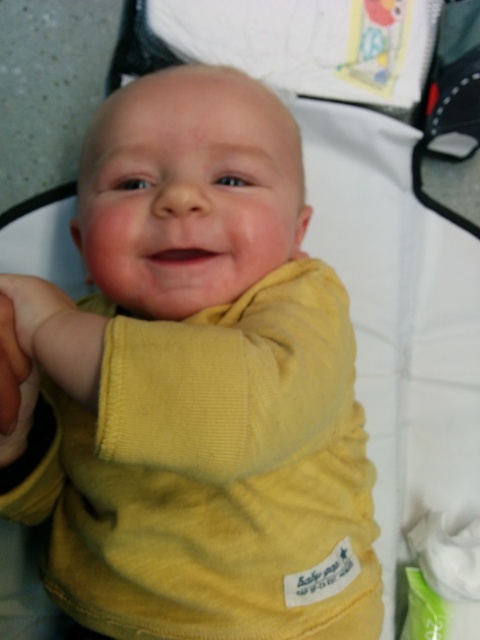
Can you confirm if yellow corduroy baby at center is bigger than white soft cloth at lower right?

Yes.

Can you confirm if yellow corduroy baby at center is positioned below white soft cloth at lower right?

Incorrect, yellow corduroy baby at center is not positioned below white soft cloth at lower right.

At what (x,y) coordinates should I click in order to perform the action: click on yellow corduroy baby at center. Please return your answer as a coordinate pair (x, y). Looking at the image, I should click on (195, 385).